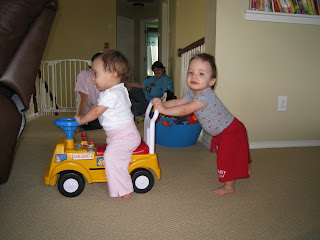
At what (x,y) coordinates should I click in order to perform the action: click on back wheel of toy. Please return your answer as a coordinate pair (x, y). The width and height of the screenshot is (320, 240). Looking at the image, I should click on (138, 171).